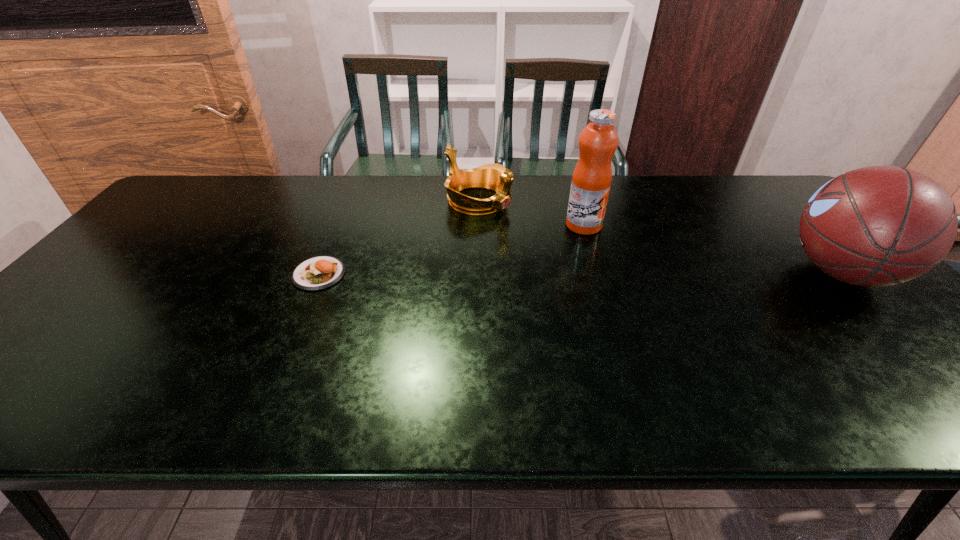
Locate an element on the screen. blank region between the fruit juice and the second shortest object is located at coordinates (531, 213).

Locate an element on the screen. free spot between the tiara and the tallest object is located at coordinates (531, 213).

In order to click on free space between the tiara and the fruit juice in this screenshot , I will do `click(531, 213)`.

The image size is (960, 540). I want to click on vacant space that is in between the second object from right to left and the patty (food), so click(451, 250).

You are a GUI agent. You are given a task and a screenshot of the screen. Output one action in this format:
    pyautogui.click(x=<x>, y=<y>)
    Task: Click on the object that is the closest to the rightmost object
    
    Given the screenshot: What is the action you would take?
    pyautogui.click(x=591, y=181)

Locate which object ranks in proximity to the patty (food). Please provide its 2D coordinates. Your answer should be formatted as a tuple, i.e. [(x, y)], where the tuple contains the x and y coordinates of a point satisfying the conditions above.

[(496, 177)]

This screenshot has width=960, height=540. In order to click on vacant space that satisfies the following two spatial constraints: 1. on the front side of the rightmost object; 2. on the right side of the tallest object in this screenshot , I will do `click(598, 272)`.